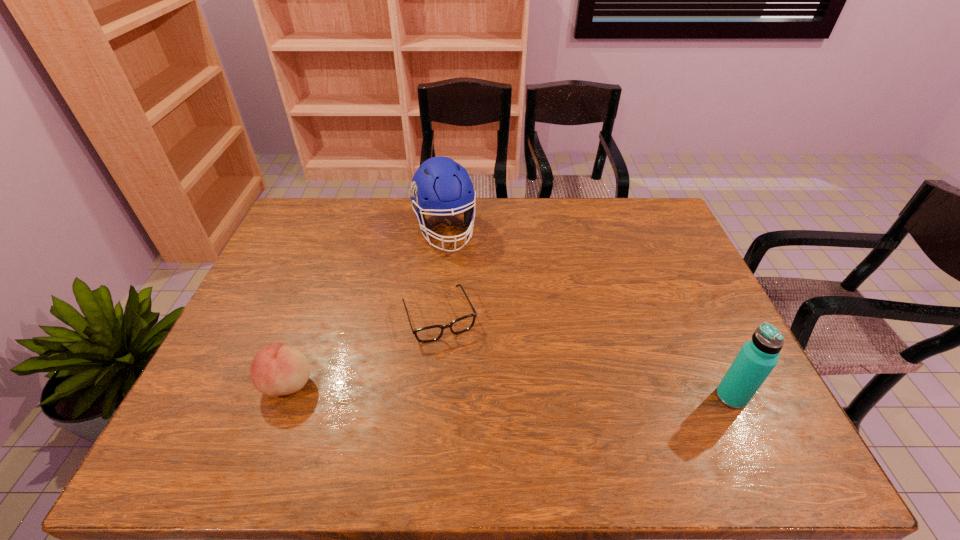
Find the location of a particular element. free space between the leftmost object and the farthest object is located at coordinates (367, 307).

You are a GUI agent. You are given a task and a screenshot of the screen. Output one action in this format:
    pyautogui.click(x=<x>, y=<y>)
    Task: Click on the free spot between the spectacles and the water bottle
    The image size is (960, 540).
    Given the screenshot: What is the action you would take?
    pyautogui.click(x=586, y=356)

Locate an element on the screen. The image size is (960, 540). unoccupied area between the third nearest object and the peach is located at coordinates (364, 349).

Identify the location of free space between the second shortest object and the water bottle. (510, 390).

Identify the location of empty space that is in between the farthest object and the water bottle. Image resolution: width=960 pixels, height=540 pixels. (588, 313).

I want to click on vacant point located between the water bottle and the football helmet, so click(588, 313).

Locate an element on the screen. vacant area that lies between the third nearest object and the second shortest object is located at coordinates (364, 349).

In order to click on free space between the second farthest object and the peach in this screenshot , I will do `click(364, 349)`.

Where is `vacant space that is in between the shortest object and the farthest object`? This screenshot has height=540, width=960. vacant space that is in between the shortest object and the farthest object is located at coordinates (442, 273).

Identify which object is the third nearest to the water bottle. Please provide its 2D coordinates. Your answer should be formatted as a tuple, i.e. [(x, y)], where the tuple contains the x and y coordinates of a point satisfying the conditions above.

[(276, 370)]